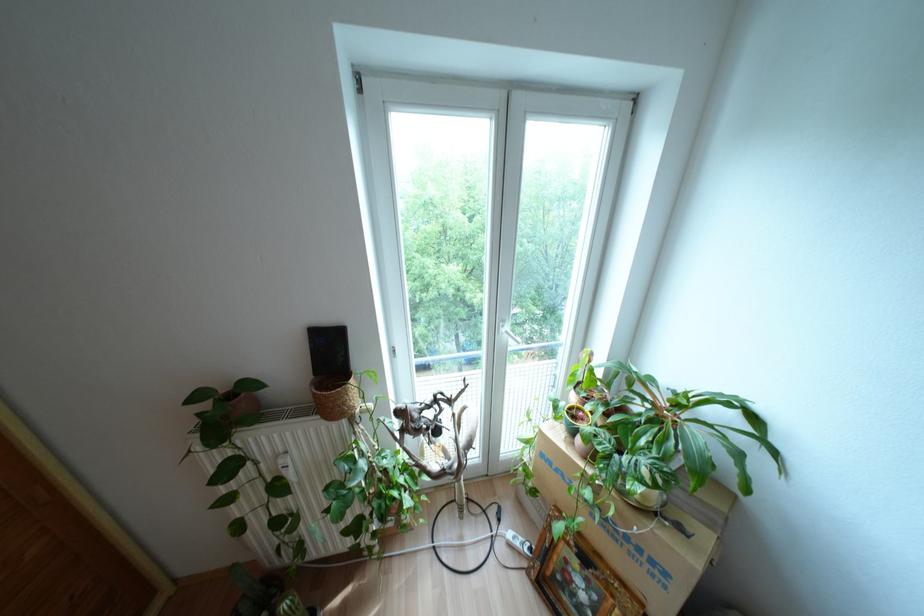
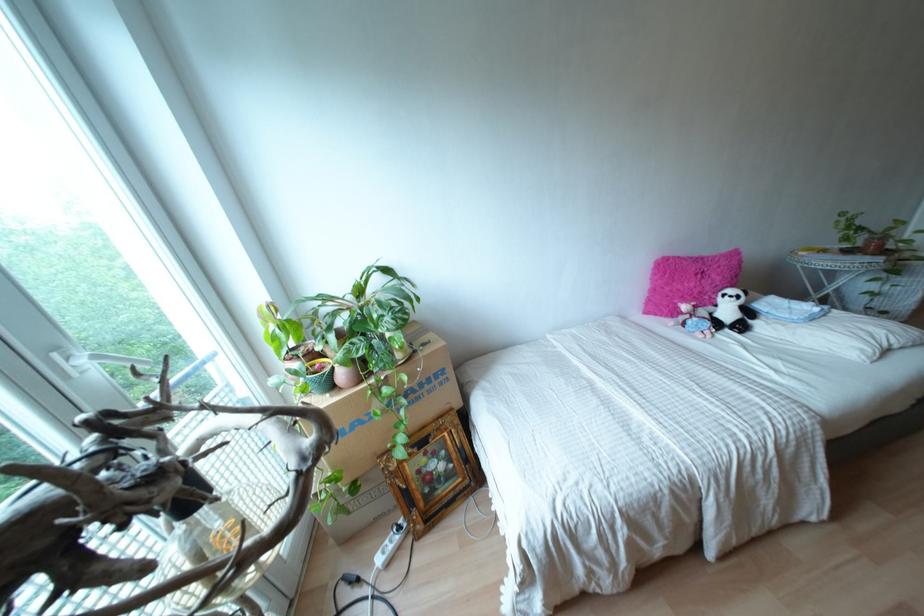
Find the pixel in the second image that matches [569,569] in the first image.

(423, 469)